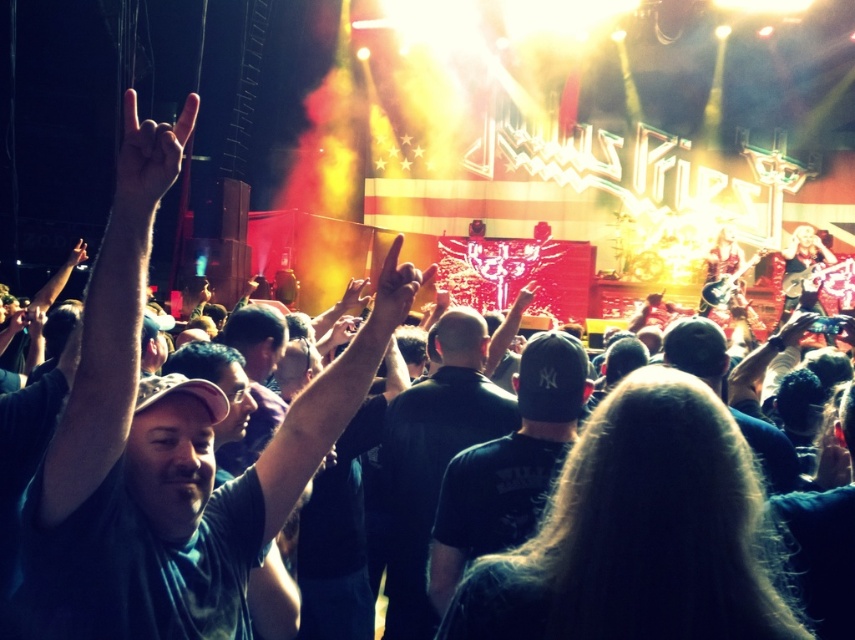
From the picture: You are a photographer at the concert and want to capture a closeup of the dark green tshirt at left. The camera you are using has a focus point at coordinate point (168, 474). Is the dark green tshirt at left positioned at that focus point?

The dark green tshirt at left is located at point (168, 474), so yes, the focus point is correctly positioned at that coordinate.